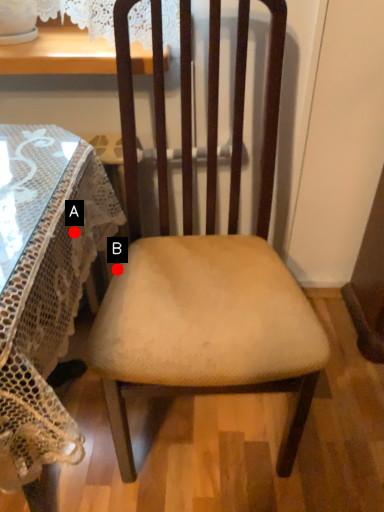
Question: Two points are circled on the image, labeled by A and B beside each circle. Among these points, which one is farthest from the camera?

Choices:
 (A) A is further
 (B) B is further

Answer: (B)